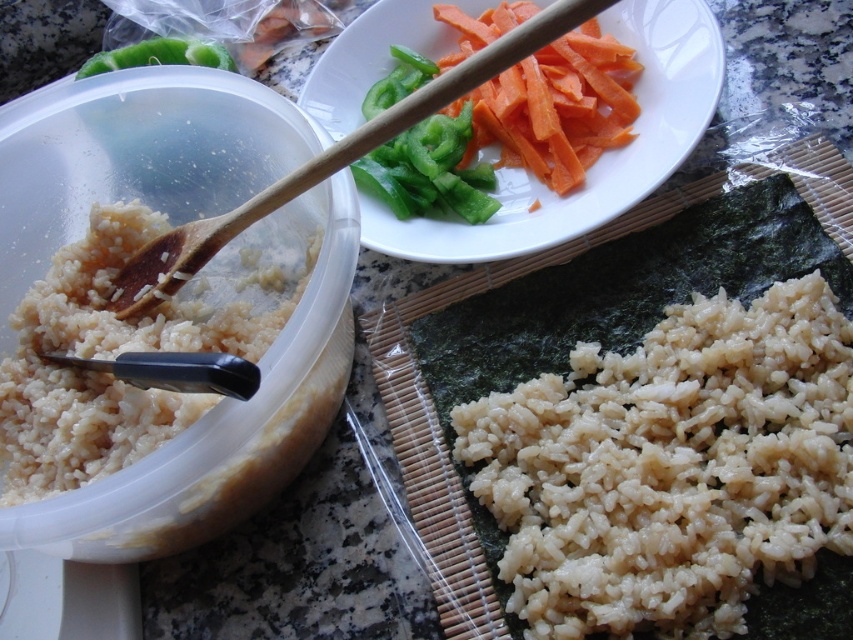
Which is more to the left, white matte rice at center left or green matte bell pepper at upper left?

green matte bell pepper at upper left

Can you confirm if white matte rice at center left is shorter than green matte bell pepper at upper left?

No, white matte rice at center left is not shorter than green matte bell pepper at upper left.

Image resolution: width=853 pixels, height=640 pixels. What are the coordinates of `white matte rice at center left` in the screenshot? It's located at (113, 356).

Which is above, smooth white bowl at upper center or sliced orange carrot at upper right?

Positioned higher is sliced orange carrot at upper right.

Does point (357, 106) lie in front of point (524, 150)?

No, it is not.

Identify the location of smooth white bowl at upper center. (601, 157).

Identify the location of smooth white bowl at upper center. (601, 157).

Measure the distance from slightly translucent brown rice at lower right to wooden spoon at upper left.

slightly translucent brown rice at lower right and wooden spoon at upper left are 36.48 centimeters apart from each other.

Which is below, slightly translucent brown rice at lower right or wooden spoon at upper left?

slightly translucent brown rice at lower right is lower down.

You are a GUI agent. You are given a task and a screenshot of the screen. Output one action in this format:
    pyautogui.click(x=<x>, y=<y>)
    Task: Click on the slightly translucent brown rice at lower right
    
    Given the screenshot: What is the action you would take?
    pyautogui.click(x=672, y=467)

The height and width of the screenshot is (640, 853). What are the coordinates of `slightly translucent brown rice at lower right` in the screenshot? It's located at (672, 467).